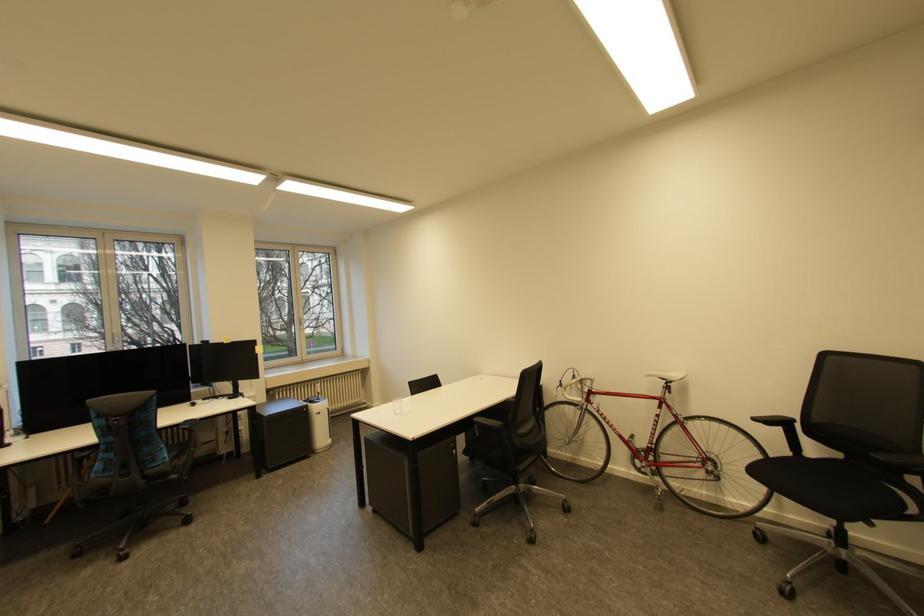
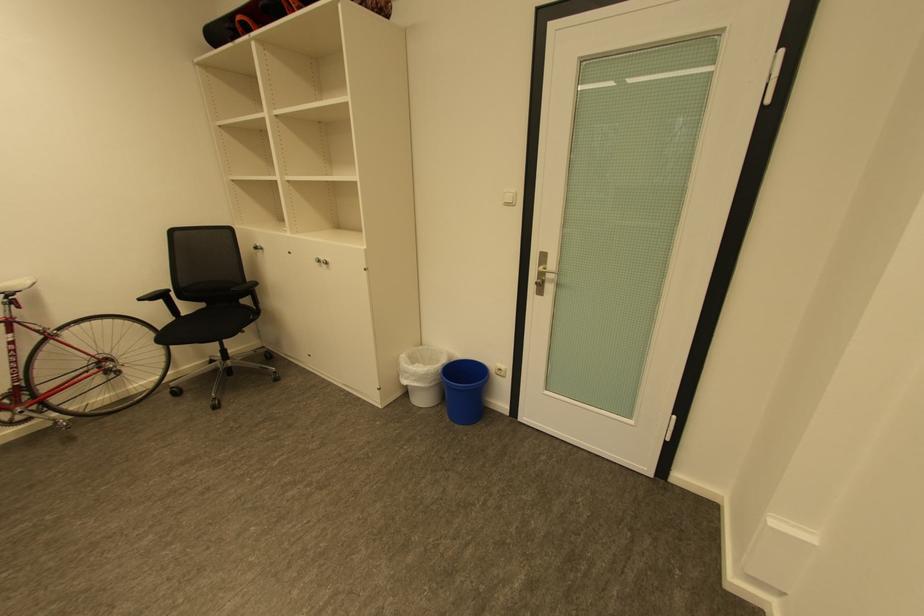
Where in the second image is the point corresponding to (x=761, y=419) from the first image?

(148, 300)